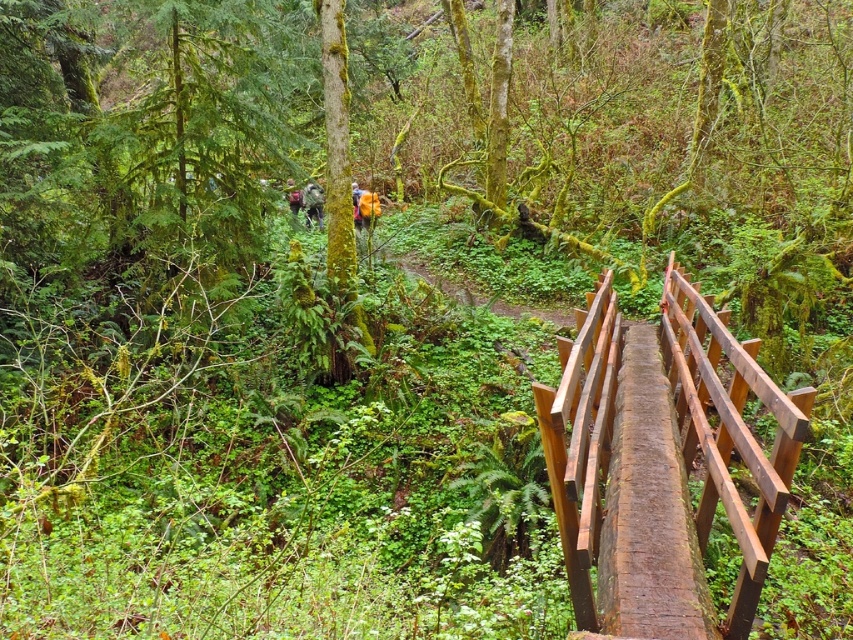
Question: From the image, what is the correct spatial relationship of brown wooden rail at upper right in relation to camouflage backpack at center?

Choices:
 (A) above
 (B) below

Answer: (B)

Question: Does brown wooden rail at upper right have a larger size compared to camouflage backpack at center?

Choices:
 (A) yes
 (B) no

Answer: (A)

Question: Which of the following is the farthest from the observer?

Choices:
 (A) (294, 198)
 (B) (318, 200)

Answer: (B)

Question: Which point is closer to the camera taking this photo?

Choices:
 (A) (318, 220)
 (B) (718, 376)
 (C) (289, 193)

Answer: (B)

Question: Is camouflage fabric backpack at center wider than camouflage backpack at center?

Choices:
 (A) yes
 (B) no

Answer: (A)

Question: Which is nearer to the camouflage fabric backpack at center?

Choices:
 (A) brown wooden rail at upper right
 (B) camouflage backpack at center

Answer: (B)